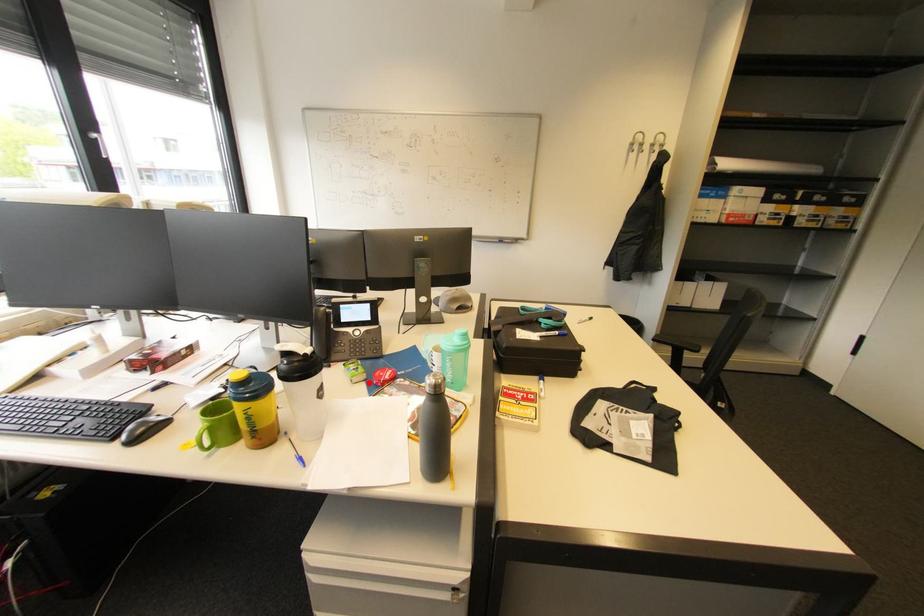
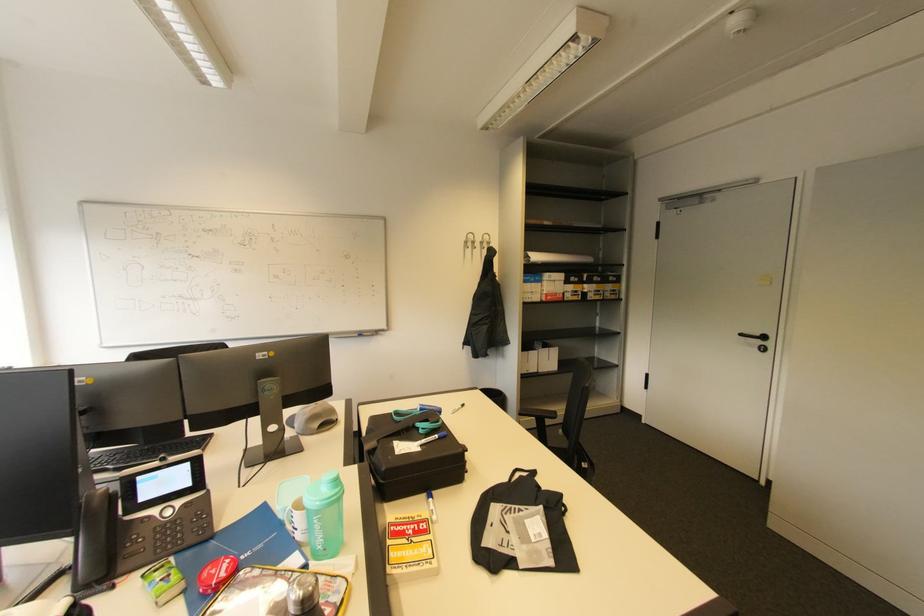
Question: I am providing you with two images of the same scene from different viewpoints. A red point is marked on the first image. Can you still see the location of the red point in image 2?

Choices:
 (A) Yes
 (B) No

Answer: (A)